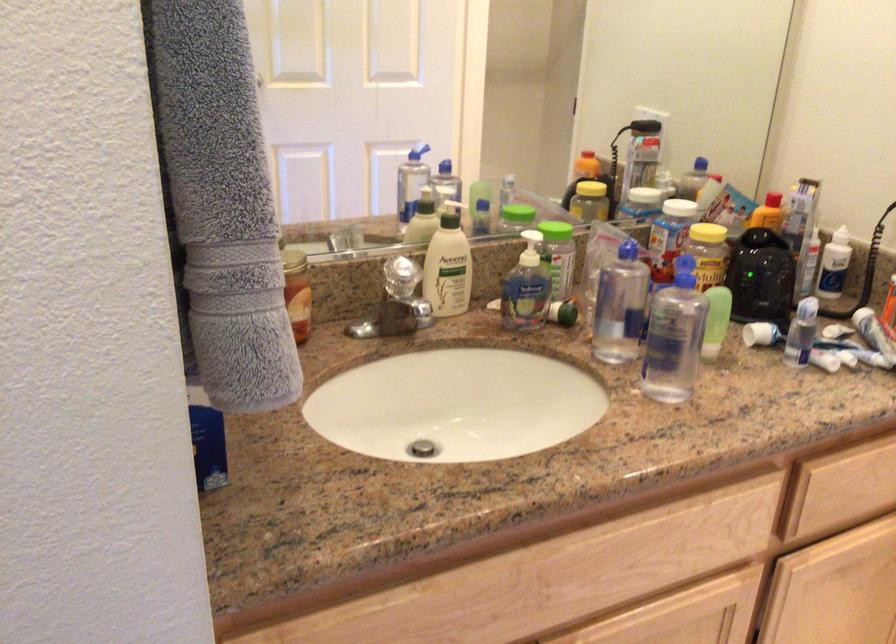
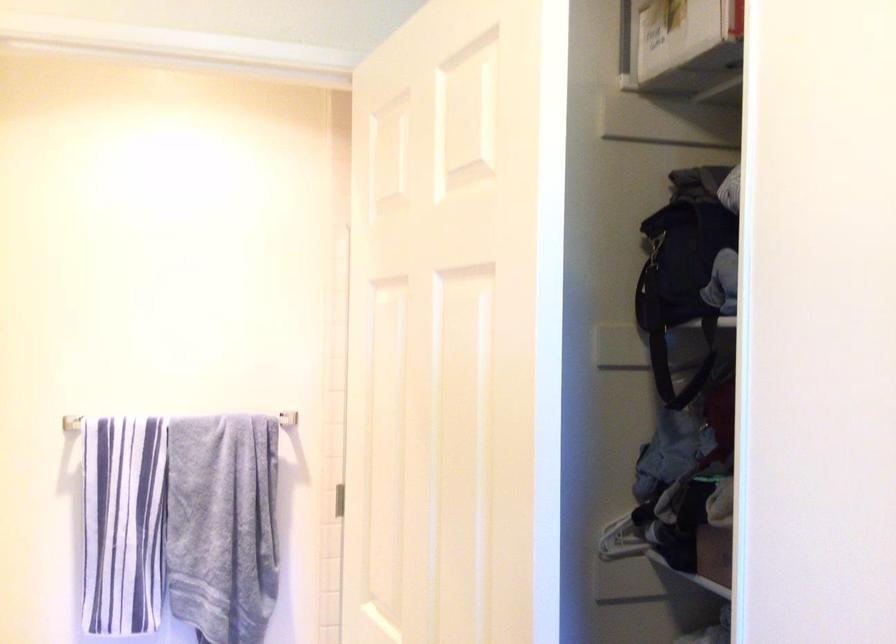
Question: The camera is either moving clockwise (left) or counter-clockwise (right) around the object. The first image is from the beginning of the video and the second image is from the end. Is the camera moving left or right when shooting the video?

Choices:
 (A) Left
 (B) Right

Answer: (A)